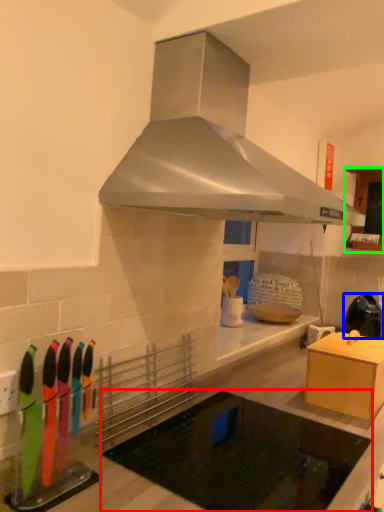
Question: Which object is the farthest from appliance (highlighted by a red box)? Choose among these: kitchen appliance (highlighted by a blue box) or cabinetry (highlighted by a green box).

Choices:
 (A) kitchen appliance
 (B) cabinetry

Answer: (B)